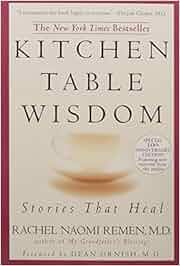
Image resolution: width=180 pixels, height=266 pixels. What are the coordinates of `cup` in the screenshot? It's located at (100, 146).